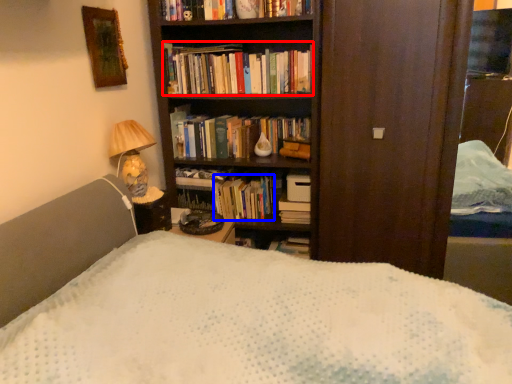
Question: Which object is closer to the camera taking this photo, book (highlighted by a red box) or book (highlighted by a blue box)?

Choices:
 (A) book
 (B) book

Answer: (A)